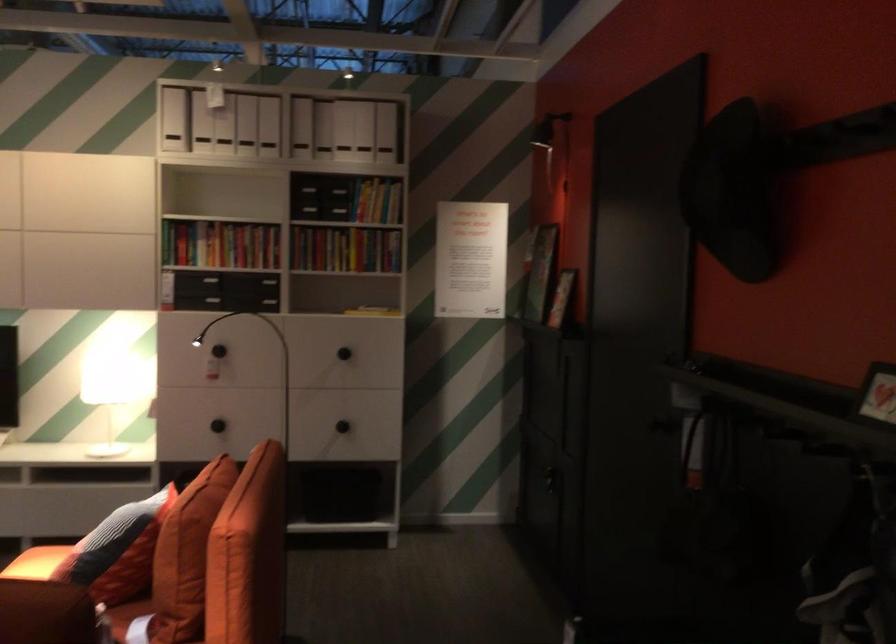
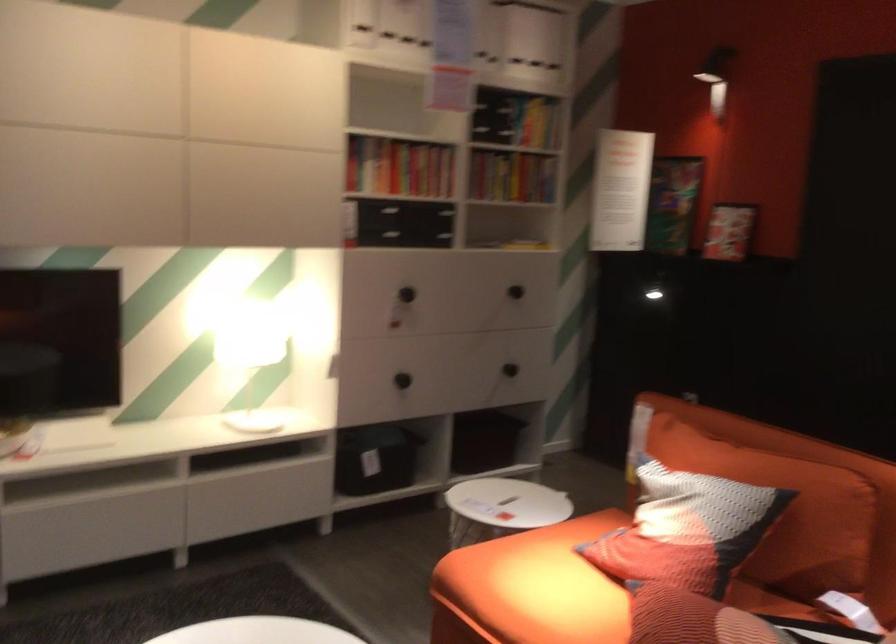
Where in the second image is the point corresponding to point (306, 431) from the first image?

(510, 368)